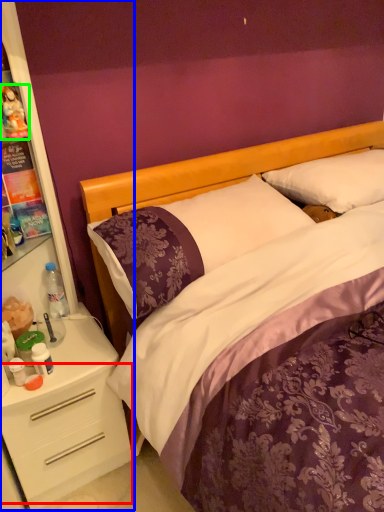
Question: Considering the real-world distances, which object is farthest from drawer (highlighted by a red box)? dresser (highlighted by a blue box) or toy (highlighted by a green box)?

Choices:
 (A) dresser
 (B) toy

Answer: (B)